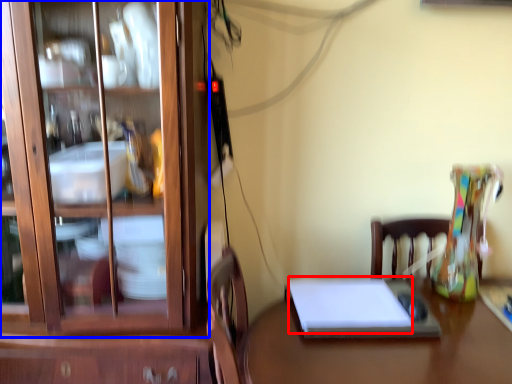
Question: Which point is further to the camera, notebook (highlighted by a red box) or cabinetry (highlighted by a blue box)?

Choices:
 (A) notebook
 (B) cabinetry

Answer: (A)